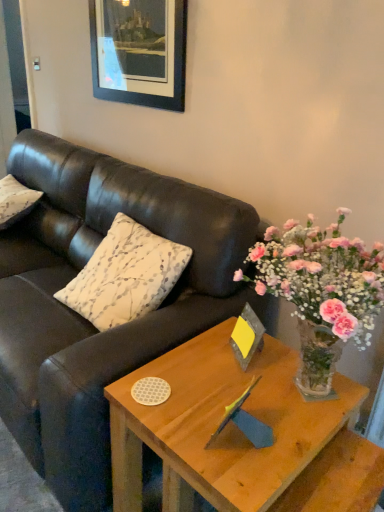
Question: Should I look upward or downward to see white printed cushion at upper left, the 1th pillow viewed from the right?

Choices:
 (A) up
 (B) down

Answer: (B)

Question: Is matte black couch at center facing away from white textured pillow at left, the first pillow positioned from the back?

Choices:
 (A) no
 (B) yes

Answer: (B)

Question: Can you confirm if matte black couch at center is taller than white textured pillow at left, placed as the 2th pillow when sorted from front to back?

Choices:
 (A) no
 (B) yes

Answer: (B)

Question: Would you say matte black couch at center is outside white textured pillow at left, positioned as the first pillow in left-to-right order?

Choices:
 (A) no
 (B) yes

Answer: (B)

Question: Is the surface of matte black couch at center in direct contact with white textured pillow at left, the 2th pillow from the right?

Choices:
 (A) no
 (B) yes

Answer: (A)

Question: Is matte black couch at center oriented towards white textured pillow at left, the first pillow positioned from the back?

Choices:
 (A) yes
 (B) no

Answer: (A)

Question: From the image's perspective, is matte black couch at center above white textured pillow at left, the 2th pillow from the right?

Choices:
 (A) no
 (B) yes

Answer: (A)

Question: Would you say white printed cushion at upper left, the 1th pillow viewed from the right, is part of wooden picture frame at upper center, which appears as the second picture frame when ordered from the bottom,'s contents?

Choices:
 (A) yes
 (B) no

Answer: (B)

Question: Is wooden picture frame at upper center, which is counted as the second picture frame, starting from the front, thinner than white printed cushion at upper left, which is counted as the first pillow, starting from the front?

Choices:
 (A) no
 (B) yes

Answer: (B)

Question: Is white printed cushion at upper left, the 1th pillow viewed from the right, at the back of wooden picture frame at upper center, which is the 1th picture frame in top-to-bottom order?

Choices:
 (A) no
 (B) yes

Answer: (A)

Question: Can you confirm if wooden picture frame at upper center, which appears as the second picture frame when ordered from the bottom, is wider than white printed cushion at upper left, the 1th pillow viewed from the right?

Choices:
 (A) no
 (B) yes

Answer: (A)

Question: From a real-world perspective, is wooden picture frame at upper center, which is the 1th picture frame in top-to-bottom order, on top of white printed cushion at upper left, which is counted as the first pillow, starting from the front?

Choices:
 (A) yes
 (B) no

Answer: (A)

Question: Is wooden picture frame at upper center, which is the 1th picture frame in top-to-bottom order, positioned far away from white printed cushion at upper left, the 2th pillow positioned from the left?

Choices:
 (A) yes
 (B) no

Answer: (B)

Question: Is matte black couch at center not within light brown wood coffee table at center?

Choices:
 (A) yes
 (B) no

Answer: (A)